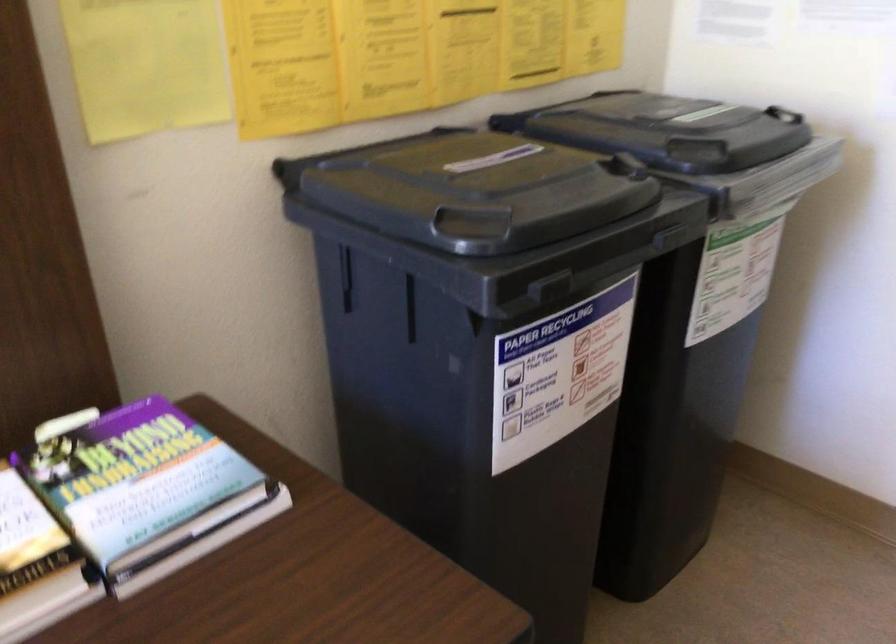
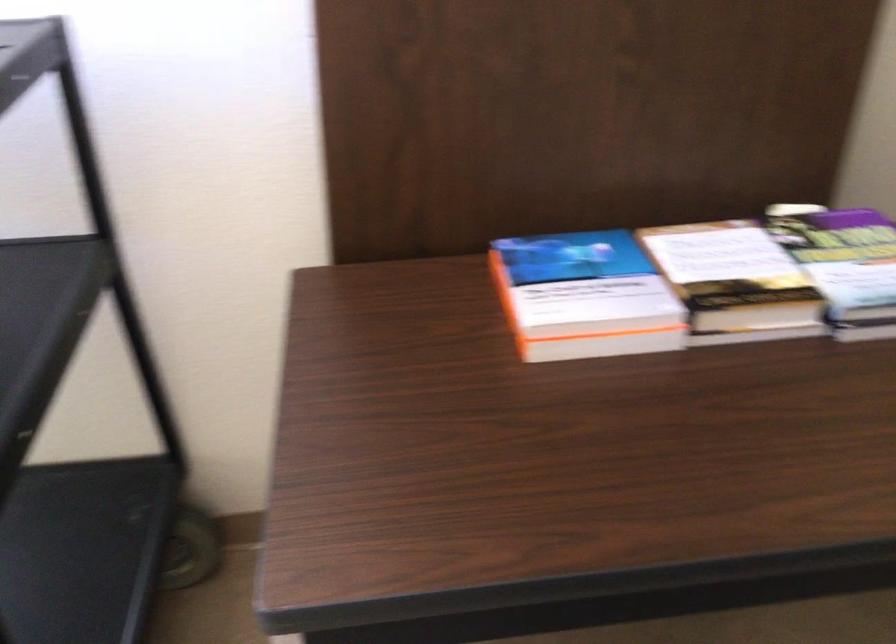
Find the pixel in the second image that matches (143,464) in the first image.

(847, 260)